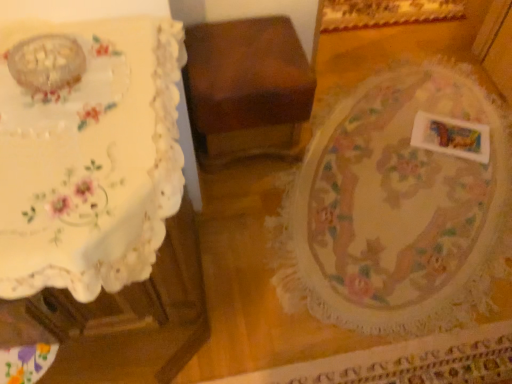
Where is `vacant space behind white matte rectangular object at lower right`? vacant space behind white matte rectangular object at lower right is located at coordinates (438, 101).